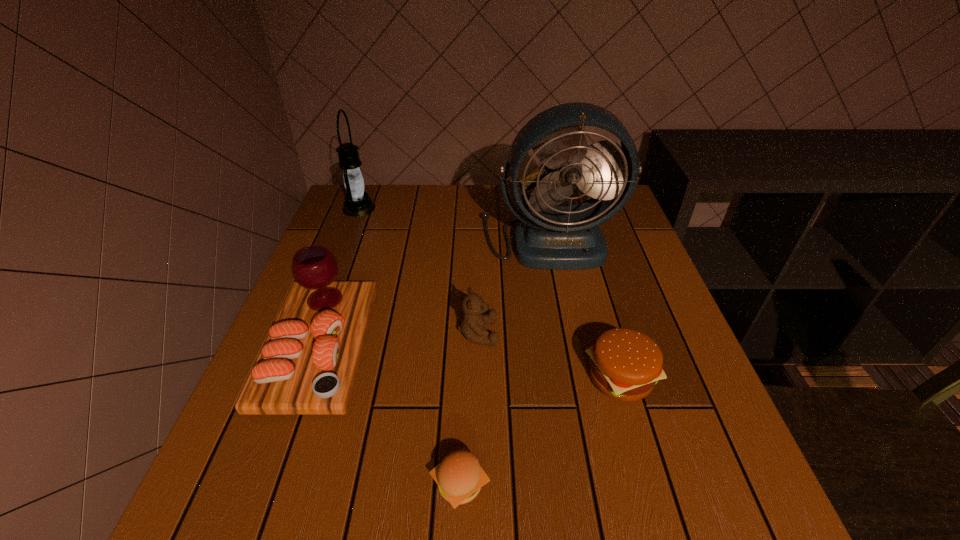
Locate an element on the screen. The image size is (960, 540). free space that satisfies the following two spatial constraints: 1. on the front-facing side of the third shortest object; 2. on the back side of the farther hamburger is located at coordinates (478, 377).

Identify the location of free location that satisfies the following two spatial constraints: 1. on the front-facing side of the fourth tallest object; 2. on the left side of the farther hamburger. (478, 377).

Identify the location of vacant region that satisfies the following two spatial constraints: 1. on the front-facing side of the fourth tallest object; 2. on the right side of the farther hamburger. (478, 377).

You are a GUI agent. You are given a task and a screenshot of the screen. Output one action in this format:
    pyautogui.click(x=<x>, y=<y>)
    Task: Click on the free space that satisfies the following two spatial constraints: 1. on the front side of the platter; 2. on the right side of the second shortest object
    The image size is (960, 540).
    Given the screenshot: What is the action you would take?
    pyautogui.click(x=309, y=377)

Where is `free space in the image that satisfies the following two spatial constraints: 1. on the front-facing side of the third shortest object; 2. on the right side of the taller hamburger`? free space in the image that satisfies the following two spatial constraints: 1. on the front-facing side of the third shortest object; 2. on the right side of the taller hamburger is located at coordinates (478, 377).

Where is `vacant space that satisfies the following two spatial constraints: 1. in front of the tallest object to blow air; 2. on the front-facing side of the third shortest object`? vacant space that satisfies the following two spatial constraints: 1. in front of the tallest object to blow air; 2. on the front-facing side of the third shortest object is located at coordinates (567, 333).

Locate an element on the screen. vacant space that satisfies the following two spatial constraints: 1. on the side where the lantern emits light; 2. on the back side of the third tallest object is located at coordinates pos(305,348).

Where is `free spot that satisfies the following two spatial constraints: 1. on the side where the fifth shortest object emits light; 2. on the left side of the taller hamburger`? free spot that satisfies the following two spatial constraints: 1. on the side where the fifth shortest object emits light; 2. on the left side of the taller hamburger is located at coordinates [x=294, y=377].